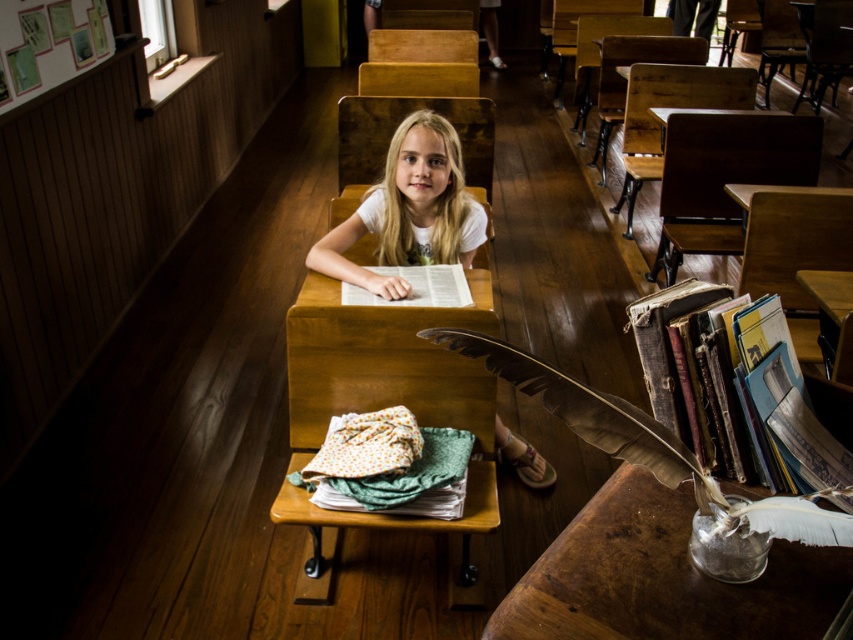
Question: Which object is closer to the camera taking this photo?

Choices:
 (A) white paper book at center
 (B) wooden frame at upper left

Answer: (A)

Question: Is hardcover books at right wider than white paper book at center?

Choices:
 (A) no
 (B) yes

Answer: (A)

Question: Which point is farther to the camera?

Choices:
 (A) wooden at center
 (B) white paper book at center

Answer: (B)

Question: Can you confirm if wooden desk at center is positioned above wooden frame at upper left?

Choices:
 (A) no
 (B) yes

Answer: (A)

Question: Which of these objects is positioned closest to the white paper book at center?

Choices:
 (A) smooth blonde hair at center
 (B) wooden frame at upper left
 (C) hardcover books at right
 (D) wooden at center

Answer: (D)

Question: Considering the relative positions of wooden desk at center and wooden table at center in the image provided, where is wooden desk at center located with respect to wooden table at center?

Choices:
 (A) below
 (B) above

Answer: (A)